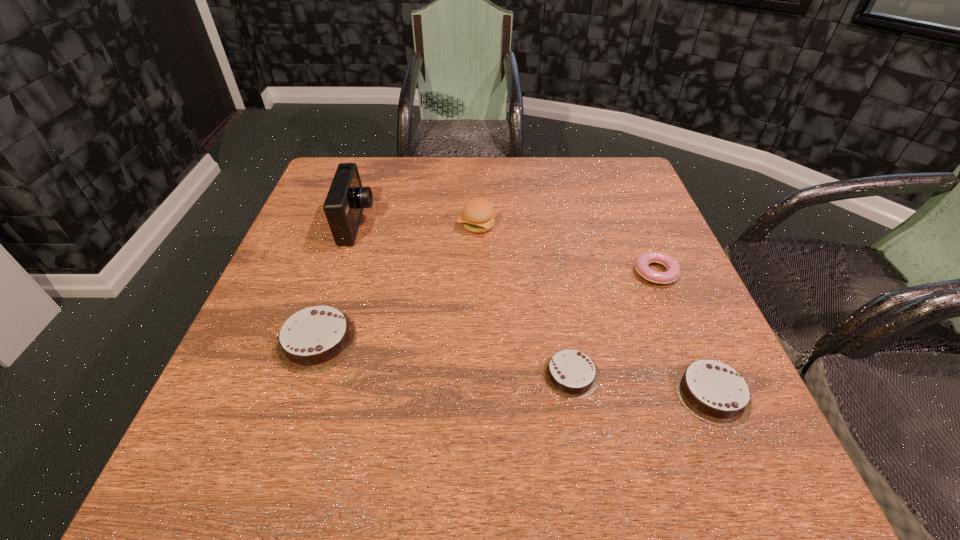
If we want them evenly spaced by inserting an extra chocolate_cake among them, please locate a free spot for this new chocolate_cake. Please provide its 2D coordinates. Your answer should be formatted as a tuple, i.e. [(x, y)], where the tuple contains the x and y coordinates of a point satisfying the conditions above.

[(440, 357)]